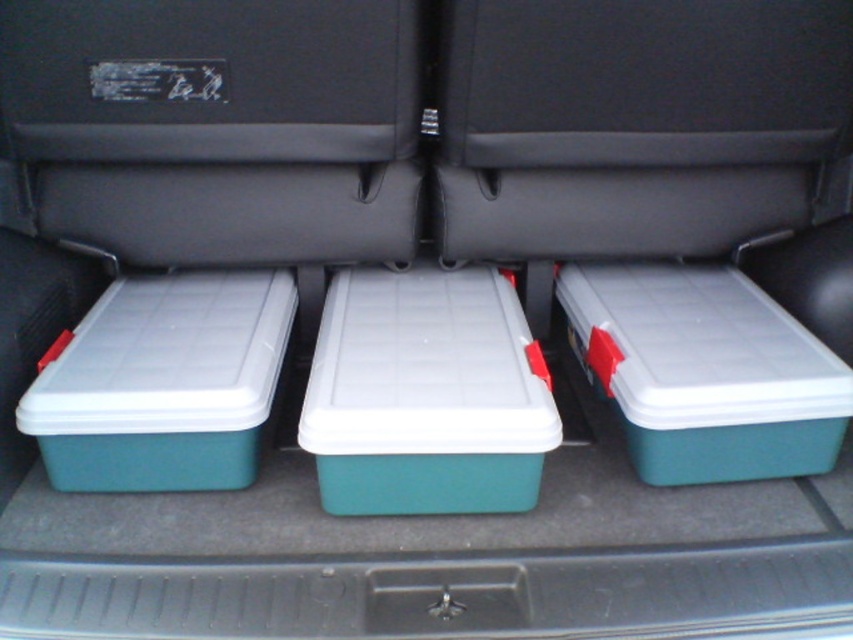
Who is more forward, (x=755, y=109) or (x=376, y=420)?

Positioned in front is point (x=376, y=420).

Who is positioned more to the left, green plastic container at center or teal plastic storage box at center?

teal plastic storage box at center

This screenshot has width=853, height=640. Describe the element at coordinates (636, 122) in the screenshot. I see `green plastic container at center` at that location.

The width and height of the screenshot is (853, 640). Identify the location of green plastic container at center. (636, 122).

From the picture: Does teal plastic storage box at center appear over teal plastic storage box at right?

No, teal plastic storage box at center is not above teal plastic storage box at right.

Can you confirm if teal plastic storage box at center is positioned to the right of teal plastic storage box at right?

Incorrect, teal plastic storage box at center is not on the right side of teal plastic storage box at right.

Which is behind, point (485, 477) or point (607, 387)?

The point (607, 387) is behind.

I want to click on teal plastic storage box at center, so click(x=426, y=396).

Is teal plastic storage box at center above green plastic storage box at left?

No.

Who is positioned more to the right, teal plastic storage box at center or green plastic storage box at left?

teal plastic storage box at center is more to the right.

Does point (402, 272) come behind point (161, 490)?

That is True.

Image resolution: width=853 pixels, height=640 pixels. In order to click on teal plastic storage box at center in this screenshot , I will do `click(426, 396)`.